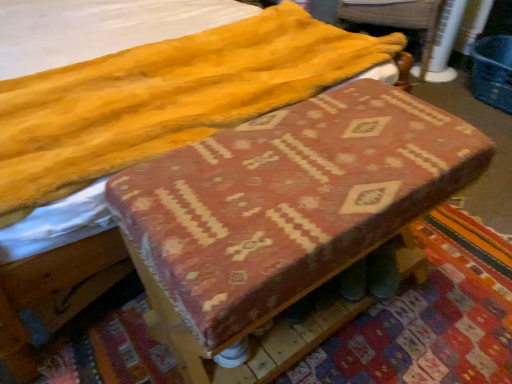
Question: Is wooden swivel chair at upper right completely or partially inside textured fabric changing table at center?

Choices:
 (A) no
 (B) yes

Answer: (A)

Question: Could you tell me if textured fabric changing table at center is turned towards wooden swivel chair at upper right?

Choices:
 (A) yes
 (B) no

Answer: (B)

Question: Is textured fabric changing table at center taller than wooden swivel chair at upper right?

Choices:
 (A) yes
 (B) no

Answer: (A)

Question: Does textured fabric changing table at center come in front of wooden swivel chair at upper right?

Choices:
 (A) no
 (B) yes

Answer: (B)

Question: Is textured fabric changing table at center thinner than wooden swivel chair at upper right?

Choices:
 (A) yes
 (B) no

Answer: (A)

Question: From the image's perspective, is textured fabric changing table at center on top of wooden swivel chair at upper right?

Choices:
 (A) no
 (B) yes

Answer: (A)

Question: Can you confirm if wooden swivel chair at upper right is wider than textured fabric changing table at center?

Choices:
 (A) no
 (B) yes

Answer: (B)

Question: Considering the relative positions of wooden swivel chair at upper right and textured fabric changing table at center in the image provided, is wooden swivel chair at upper right in front of textured fabric changing table at center?

Choices:
 (A) no
 (B) yes

Answer: (A)

Question: Does wooden swivel chair at upper right have a lesser height compared to textured fabric changing table at center?

Choices:
 (A) yes
 (B) no

Answer: (A)

Question: Is wooden swivel chair at upper right in contact with textured fabric changing table at center?

Choices:
 (A) no
 (B) yes

Answer: (A)

Question: Is wooden swivel chair at upper right taller than textured fabric changing table at center?

Choices:
 (A) no
 (B) yes

Answer: (A)

Question: From a real-world perspective, is wooden swivel chair at upper right located higher than textured fabric changing table at center?

Choices:
 (A) no
 (B) yes

Answer: (A)

Question: Is textured fabric changing table at center in front of or behind wooden swivel chair at upper right in the image?

Choices:
 (A) behind
 (B) front

Answer: (B)